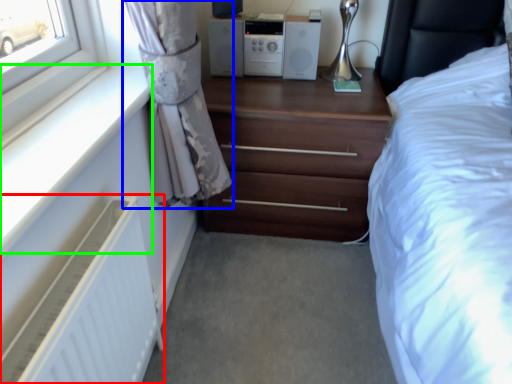
Question: Which is farther away from radiator (highlighted by a red box)? curtain (highlighted by a blue box) or window sill (highlighted by a green box)?

Choices:
 (A) curtain
 (B) window sill

Answer: (A)